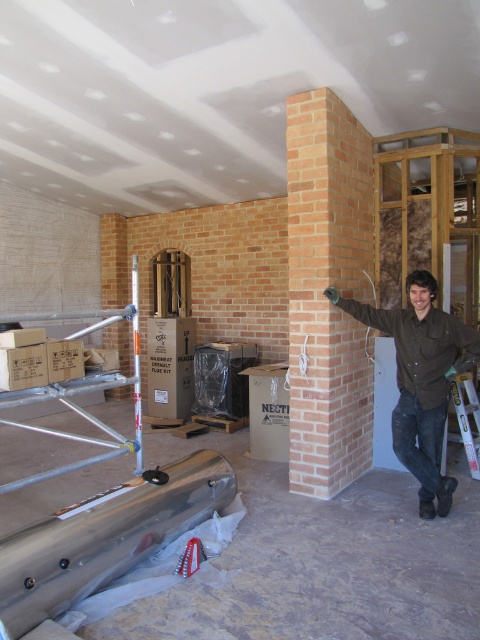
Question: Which of the following is the farthest from the observer?

Choices:
 (A) (479, 412)
 (B) (436, 392)

Answer: (A)

Question: Which object appears farthest from the camera in this image?

Choices:
 (A) brown cotton shirt at center
 (B) metallic silver ladder at right

Answer: (B)

Question: Considering the real-world distances, which object is closest to the light brown brick chimney at center?

Choices:
 (A) metallic silver ladder at right
 (B) brown cotton shirt at center

Answer: (B)

Question: In this image, where is light brown brick chimney at center located relative to brown cotton shirt at center?

Choices:
 (A) right
 (B) left

Answer: (B)

Question: Where is light brown brick chimney at center located in relation to metallic silver ladder at right in the image?

Choices:
 (A) below
 (B) above

Answer: (B)

Question: Can you confirm if brown cotton shirt at center is wider than metallic silver ladder at right?

Choices:
 (A) no
 (B) yes

Answer: (B)